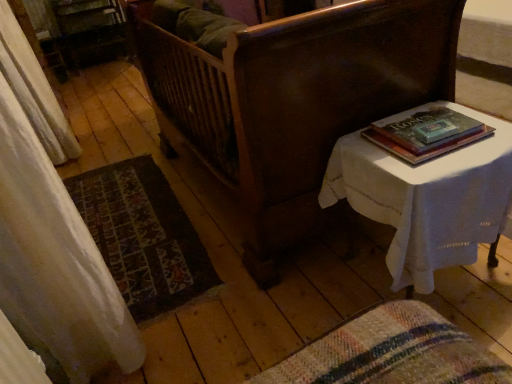
Question: In terms of width, does white cloth-covered table at right look wider or thinner when compared to carpeted mat at lower left?

Choices:
 (A) thin
 (B) wide

Answer: (A)

Question: In the image, is white cloth-covered table at right positioned in front of or behind carpeted mat at lower left?

Choices:
 (A) behind
 (B) front

Answer: (B)

Question: Which of these objects is positioned closest to the white cloth-covered table at right?

Choices:
 (A) white sheer curtain at left
 (B) dark wood bed at center
 (C) carpeted mat at lower left
 (D) hardcover book at upper right

Answer: (D)

Question: Which of these objects is positioned closest to the hardcover book at upper right?

Choices:
 (A) white cloth-covered table at right
 (B) carpeted mat at lower left
 (C) white sheer curtain at left
 (D) dark wood bed at center

Answer: (A)